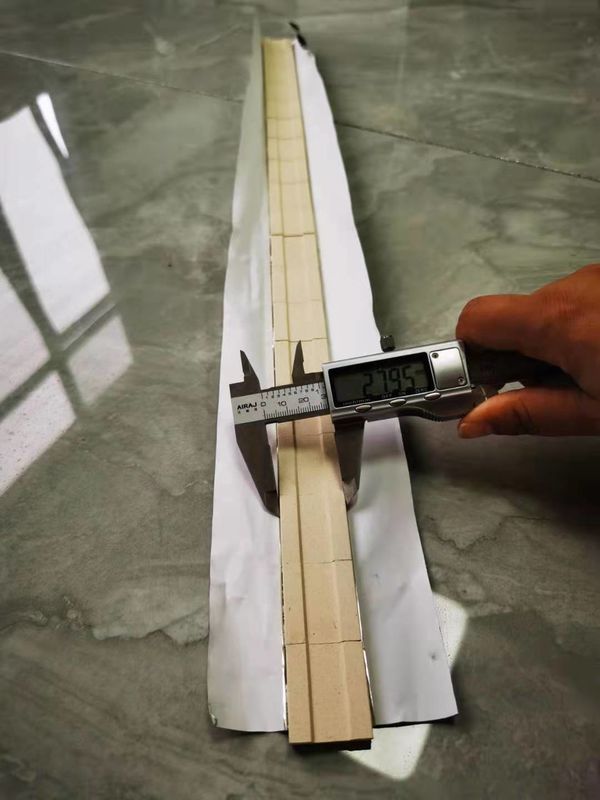
Find the location of a particular element. The image size is (600, 800). moulding is located at coordinates (325, 596).